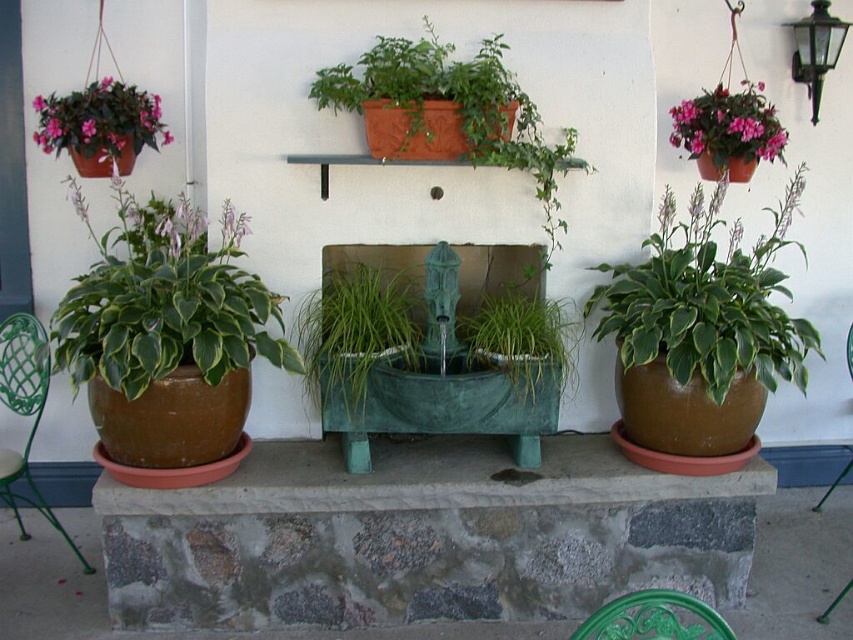
Is point (693, 193) more distant than point (30, 428)?

No.

Is green glossy hosta at right wider than green metal chair at lower left?

Yes.

What do you see at coordinates (706, 300) in the screenshot?
I see `green glossy hosta at right` at bounding box center [706, 300].

Locate an element on the screen. Image resolution: width=853 pixels, height=640 pixels. green glossy hosta at right is located at coordinates (706, 300).

Is point (773, 131) positioned after point (577, 627)?

Yes, point (773, 131) is behind point (577, 627).

Which is more to the left, matte pink flowers at upper right or green metal chair at lower center?

From the viewer's perspective, green metal chair at lower center appears more on the left side.

Is point (711, 106) farther from viewer compared to point (694, 625)?

Yes, point (711, 106) is behind point (694, 625).

At what (x,y) coordinates should I click in order to perform the action: click on matte pink flowers at upper right. Please return your answer as a coordinate pair (x, y). The height and width of the screenshot is (640, 853). Looking at the image, I should click on (728, 125).

Can you confirm if green glossy hosta at right is positioned above matte pink flowers at upper right?

No.

Does green glossy hosta at right have a lesser height compared to matte pink flowers at upper right?

In fact, green glossy hosta at right may be taller than matte pink flowers at upper right.

The height and width of the screenshot is (640, 853). In order to click on green glossy hosta at right in this screenshot , I will do `click(706, 300)`.